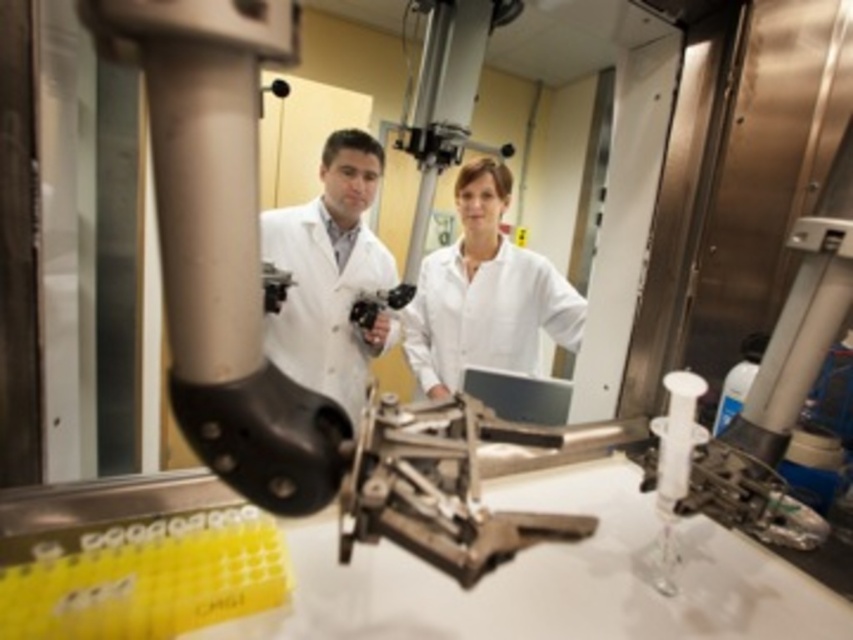
Question: Which of the following is the farthest from the observer?

Choices:
 (A) white matte lab coat at center
 (B) white lab coat at center

Answer: (A)

Question: Can you confirm if white lab coat at center is thinner than white matte lab coat at center?

Choices:
 (A) no
 (B) yes

Answer: (B)

Question: Is the position of white lab coat at center more distant than that of white matte lab coat at center?

Choices:
 (A) no
 (B) yes

Answer: (A)

Question: Does white lab coat at center appear on the right side of white matte lab coat at center?

Choices:
 (A) no
 (B) yes

Answer: (A)

Question: Which of the following is the closest to the observer?

Choices:
 (A) white lab coat at center
 (B) white matte lab coat at center

Answer: (A)